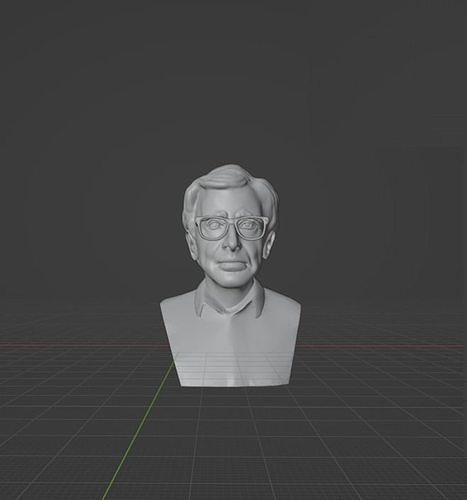
Identify the location of chest. The height and width of the screenshot is (500, 467). (226, 348).